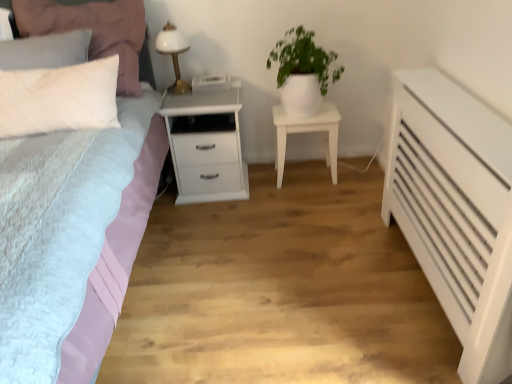
This screenshot has height=384, width=512. I want to click on vacant area that is in front of white glossy bedside lamp at upper left, so click(184, 98).